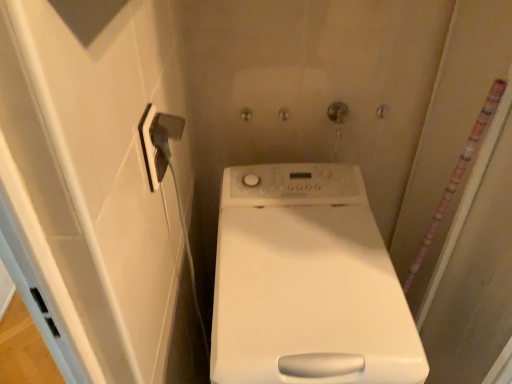
What is the approximate width of white glossy washing machine at center?

23.94 inches.

What do you see at coordinates (307, 283) in the screenshot?
I see `white glossy washing machine at center` at bounding box center [307, 283].

This screenshot has height=384, width=512. I want to click on white glossy washing machine at center, so click(x=307, y=283).

This screenshot has height=384, width=512. What are the coordinates of `white glossy washing machine at center` in the screenshot? It's located at (307, 283).